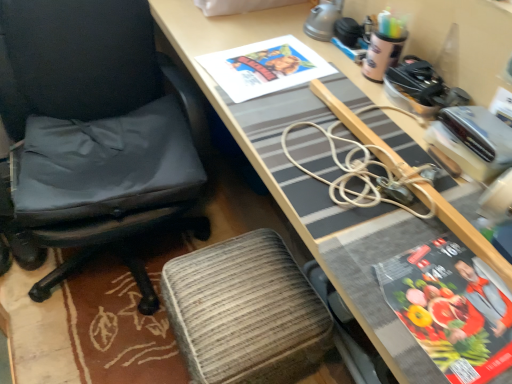
Locate an element on the screen. The image size is (512, 384). vacant region above matte paper magazine at right (from a real-world perspective) is located at coordinates (463, 292).